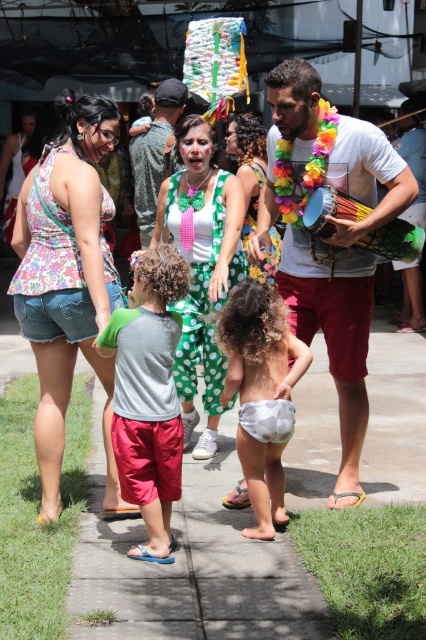
Question: Which point appears closest to the camera in this image?

Choices:
 (A) (75, 291)
 (B) (244, 122)

Answer: (A)

Question: Is floral fabric top at left above green polka dot pants at center?

Choices:
 (A) yes
 (B) no

Answer: (B)

Question: Is floral fabric top at left wider than white cotton t-shirt at center?

Choices:
 (A) no
 (B) yes

Answer: (A)

Question: Which of these objects is positioned farthest from the green textured shirt at center?

Choices:
 (A) white cotton t-shirt at center
 (B) gray cotton shirt at center

Answer: (B)

Question: Which object appears closest to the camera in this image?

Choices:
 (A) white fabric diaper at center
 (B) gray cotton shirt at center
 (C) green polka dot dress at center
 (D) white cotton t-shirt at center

Answer: (B)

Question: Does floral fabric top at left appear under gray cotton shirt at center?

Choices:
 (A) no
 (B) yes

Answer: (A)